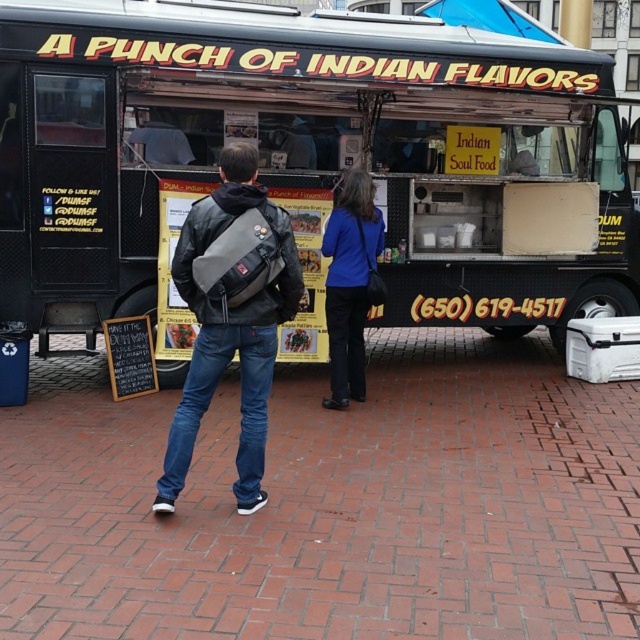
Describe the element at coordinates (308, 154) in the screenshot. I see `black matte food truck at center` at that location.

Does black matte food truck at center have a greater height compared to blue fabric jacket at center?

No, black matte food truck at center is not taller than blue fabric jacket at center.

Based on the photo, measure the distance between black matte food truck at center and camera.

7.49 meters

Find the location of a particular element. Image resolution: width=640 pixels, height=640 pixels. black matte food truck at center is located at coordinates (308, 154).

Is black matte food truck at center further to the viewer compared to leather jacket at center?

That is True.

Does point (320, 93) lie in front of point (262, 189)?

No, it is behind (262, 189).

What are the coordinates of `black matte food truck at center` in the screenshot? It's located at (308, 154).

Is blue fabric canopy at upper center below matte brown curry at center?

No.

What do you see at coordinates (490, 17) in the screenshot? Image resolution: width=640 pixels, height=640 pixels. I see `blue fabric canopy at upper center` at bounding box center [490, 17].

Between point (436, 3) and point (285, 337), which one is positioned behind?

The point (436, 3) is more distant.

Image resolution: width=640 pixels, height=640 pixels. In order to click on blue fabric canopy at upper center in this screenshot , I will do `click(490, 17)`.